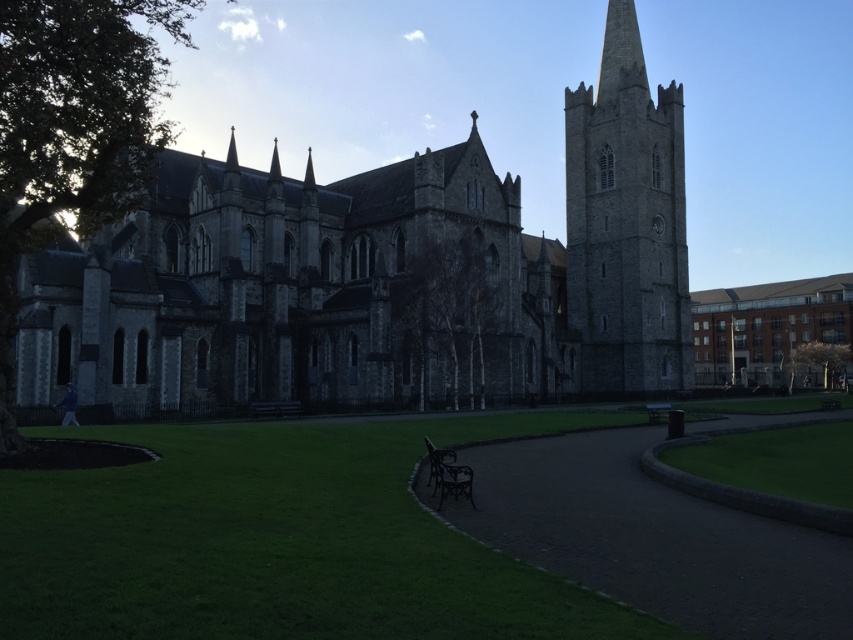
Is point (834, 449) in front of point (422, 440)?

No.

Locate an element on the screen. Image resolution: width=853 pixels, height=640 pixels. green grass at lower right is located at coordinates (776, 460).

Is dark stone path at center closer to the viewer compared to dark brown wooden bench at center?

Yes, it is in front of dark brown wooden bench at center.

Is dark stone path at center further to camera compared to dark brown wooden bench at center?

No, it is not.

Who is more forward, (693, 509) or (434, 452)?

Point (693, 509)

At what (x,y) coordinates should I click in order to perform the action: click on dark stone path at center. Please return your answer as a coordinate pair (x, y). The height and width of the screenshot is (640, 853). Looking at the image, I should click on point(654,540).

Between gray stone church at center and green grass at lower right, which one has more height?

Standing taller between the two is gray stone church at center.

Between point (281, 248) and point (837, 464), which one is positioned behind?

The point (281, 248) is behind.

Which is behind, point (131, 273) or point (770, 444)?

Point (131, 273)

Find the location of a particular element. This screenshot has width=853, height=640. gray stone church at center is located at coordinates (381, 273).